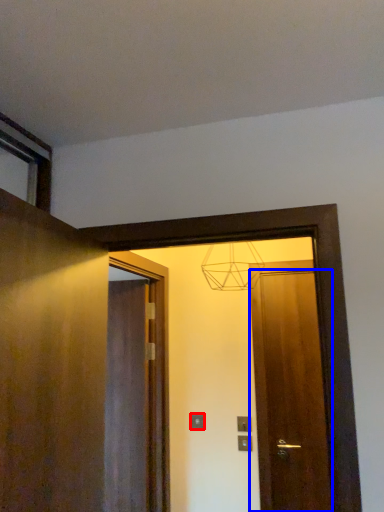
Question: Which object is closer to the camera taking this photo, electric outlet (highlighted by a red box) or door (highlighted by a blue box)?

Choices:
 (A) electric outlet
 (B) door

Answer: (B)